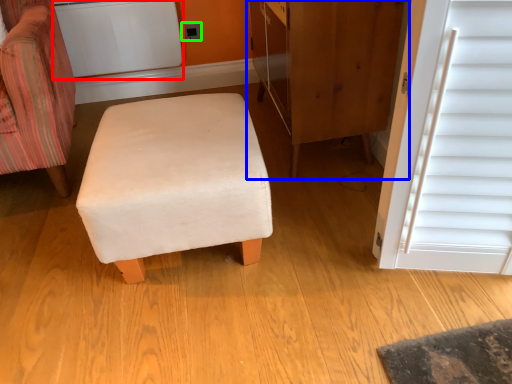
Question: Based on their relative distances, which object is farther from appliance (highlighted by a red box)? Choose from dresser (highlighted by a blue box) and electric outlet (highlighted by a green box).

Choices:
 (A) dresser
 (B) electric outlet

Answer: (A)